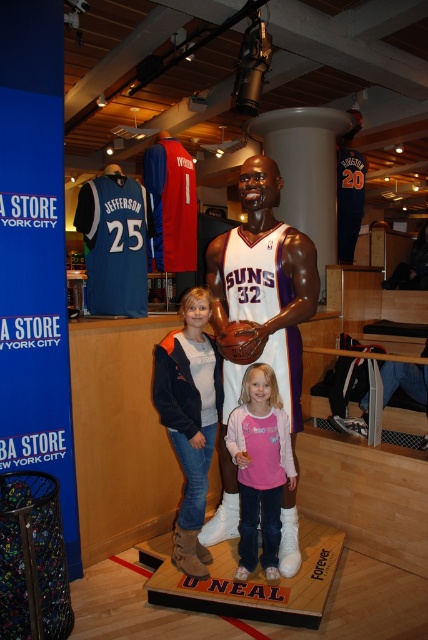
You are a store employee organizing a display. You need to place a new poster that is 1.2 meters wide between the denim jacket at center and the pink fabric shirt at center. Can the poster fit between them without overlapping either garment?

The denim jacket at center has a lesser width compared to pink fabric shirt at center. Since the poster is 1.2 meters wide, and the space between the two garments must accommodate this width, the poster can fit as long as the distance between them is at least 1.2 meters. However, the question does not provide the exact distance between the two garments, so we cannot definitively confirm if the poster will fit without overlapping.